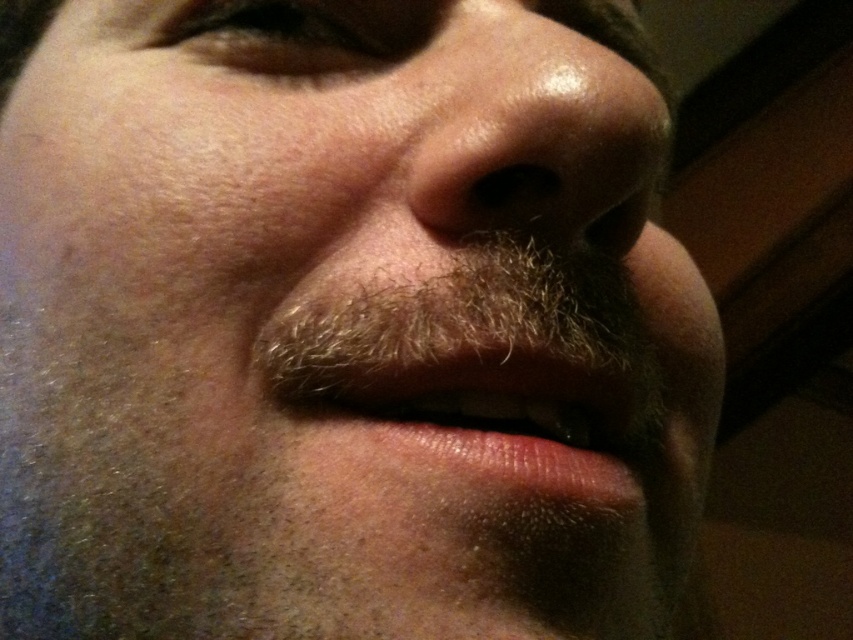
Based on the provided scene description, can you determine the exact coordinates of the smooth skin mouth at center?

The smooth skin mouth at center is located at coordinates point (x=485, y=348).